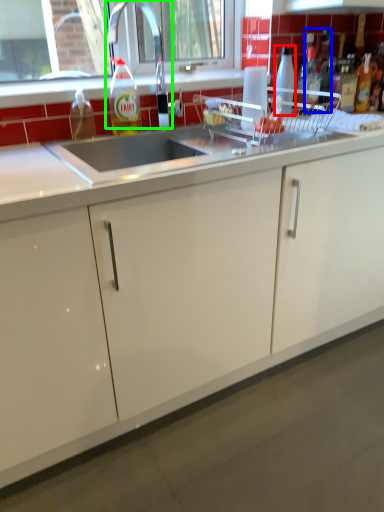
Question: Which is nearer to the bottle (highlighted by a red box)? bottle (highlighted by a blue box) or faucet (highlighted by a green box).

Choices:
 (A) bottle
 (B) faucet

Answer: (A)